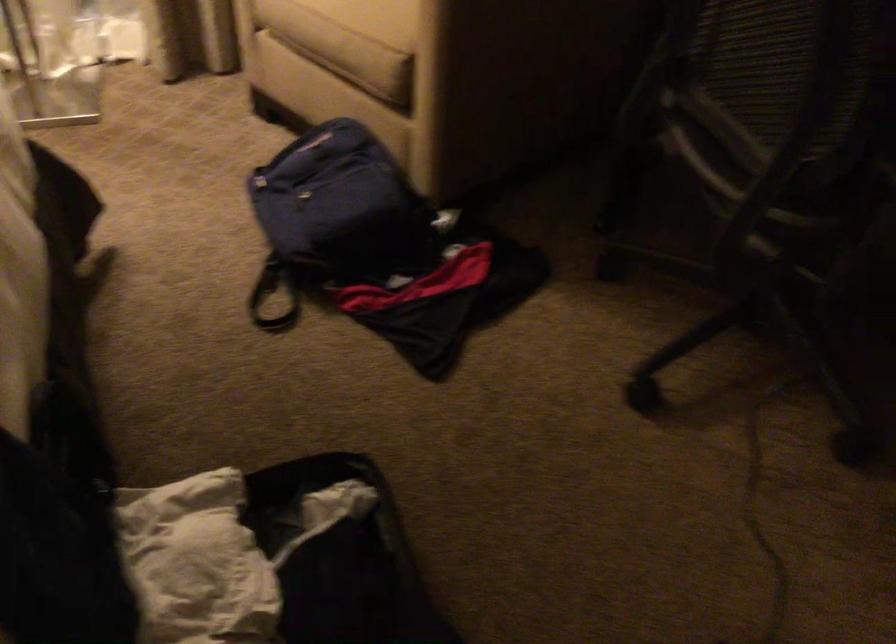
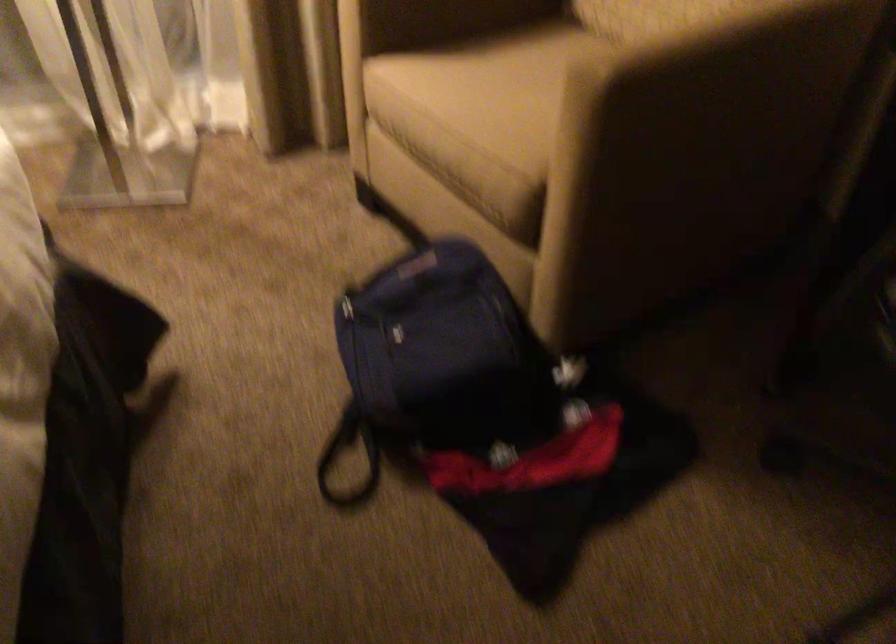
The point at (341, 210) is marked in the first image. Where is the corresponding point in the second image?

(442, 366)